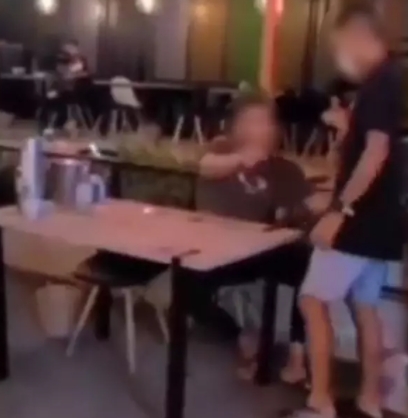
What are the coordinates of `paints` in the screenshot? It's located at (292, 268).